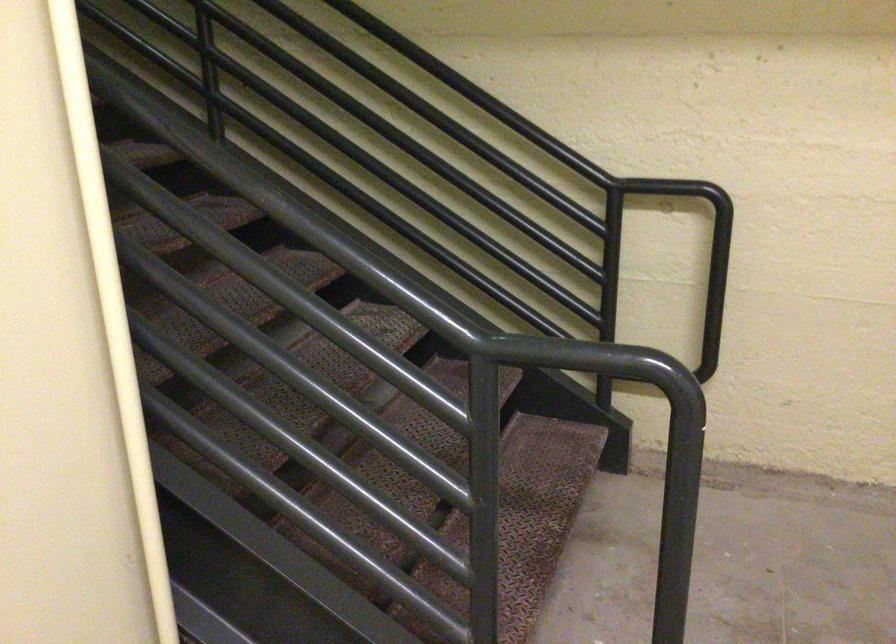
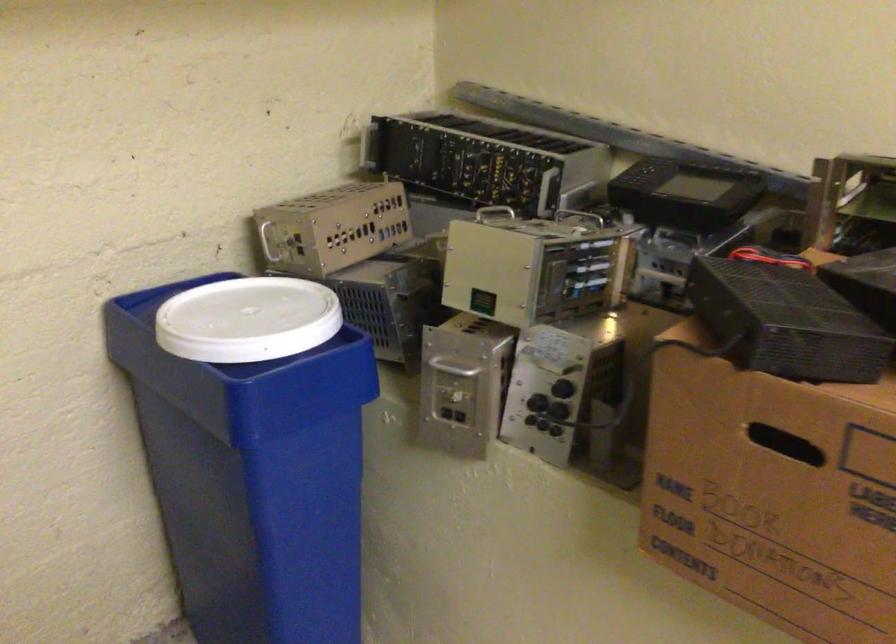
Question: The images are taken continuously from a first-person perspective. In which direction is your viewpoint rotating?

Choices:
 (A) Left
 (B) Right
 (C) Up
 (D) Down

Answer: (B)